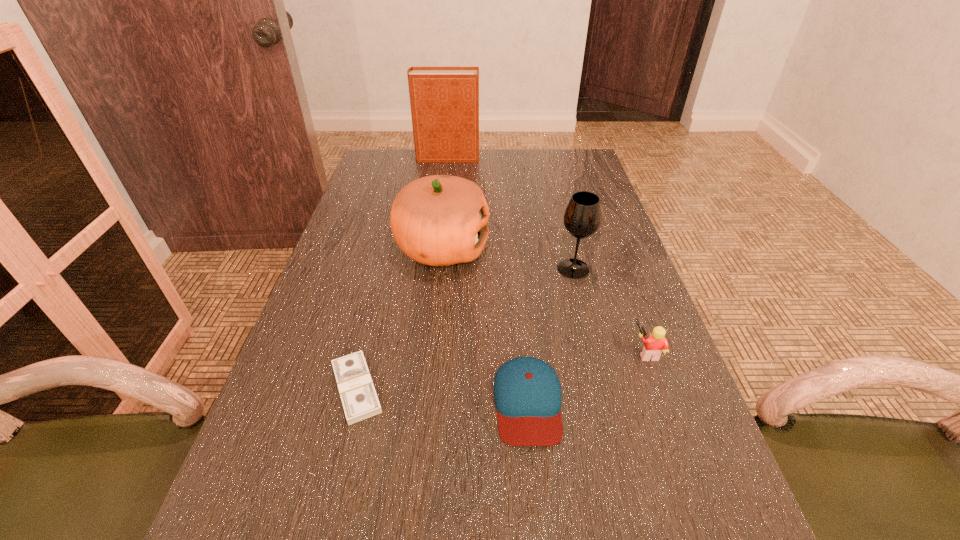
Where is `vacant space located 0.180m on the face of the pumpkin`? This screenshot has width=960, height=540. vacant space located 0.180m on the face of the pumpkin is located at coordinates (558, 248).

This screenshot has height=540, width=960. Find the location of `vacant space located 0.290m on the back of the second object from right to left`. vacant space located 0.290m on the back of the second object from right to left is located at coordinates (556, 198).

At what (x,y) coordinates should I click in order to perform the action: click on free space located 0.200m in front of the third shortest object with the accessory visible. Please return your answer as a coordinate pair (x, y). The height and width of the screenshot is (540, 960). Looking at the image, I should click on (534, 352).

The width and height of the screenshot is (960, 540). I want to click on free space located in front of the third shortest object with the accessory visible, so click(454, 352).

Find the location of a particular element. The width and height of the screenshot is (960, 540). free spot located in front of the third shortest object with the accessory visible is located at coordinates (608, 352).

Where is `free space located 0.090m with the bill of the second shortest object facing forward`? Image resolution: width=960 pixels, height=540 pixels. free space located 0.090m with the bill of the second shortest object facing forward is located at coordinates (538, 507).

The height and width of the screenshot is (540, 960). What are the coordinates of `free space located 0.340m on the back of the dollar` in the screenshot? It's located at 391,251.

This screenshot has width=960, height=540. I want to click on object that is at the far edge, so click(x=444, y=101).

I want to click on hardback book located at the left edge, so click(x=444, y=101).

Where is `pumpkin located at the left edge`? pumpkin located at the left edge is located at coordinates (439, 220).